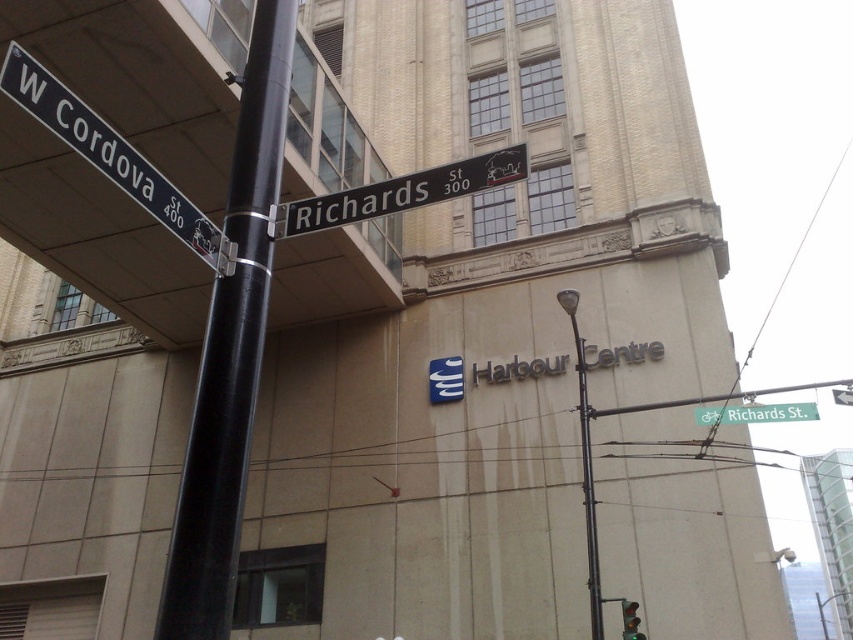
Question: Can you confirm if black metal pole at left is positioned to the left of metallic traffic light at lower right?

Choices:
 (A) no
 (B) yes

Answer: (B)

Question: Which of the following is the closest to the observer?

Choices:
 (A) green metallic street sign at upper center
 (B) white plastic street sign at upper left

Answer: (B)

Question: Which of the following is the closest to the observer?

Choices:
 (A) black metal street sign at center
 (B) white plastic street sign at upper left

Answer: (B)

Question: Is the position of white plastic street sign at upper left less distant than that of black metal street sign at center?

Choices:
 (A) yes
 (B) no

Answer: (A)

Question: Among these objects, which one is nearest to the camera?

Choices:
 (A) metallic traffic light at lower right
 (B) black metal pole at left
 (C) green metallic street sign at upper center
 (D) black metal street sign at center

Answer: (B)

Question: Does black metal pole at left come in front of green metallic street sign at upper center?

Choices:
 (A) yes
 (B) no

Answer: (A)